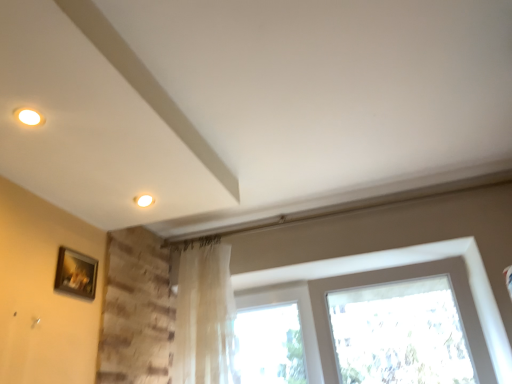
Find the location of a particular element. Image resolution: width=512 pixels, height=384 pixels. wooden picture frame at lower left is located at coordinates (76, 273).

Is translucent fabric at center positioned with its back to wooden picture frame at lower left?

translucent fabric at center does not have its back to wooden picture frame at lower left.

Are translucent fabric at center and wooden picture frame at lower left far apart?

That's right, there is a large distance between translucent fabric at center and wooden picture frame at lower left.

Looking at this image, is translucent fabric at center taller than wooden picture frame at lower left?

Yes, translucent fabric at center is taller than wooden picture frame at lower left.

Considering the relative sizes of translucent fabric at center and wooden picture frame at lower left in the image provided, is translucent fabric at center bigger than wooden picture frame at lower left?

Indeed, translucent fabric at center has a larger size compared to wooden picture frame at lower left.

From the image's perspective, is wooden picture frame at lower left below translucent fabric curtain at center?

No, from the image's perspective, wooden picture frame at lower left is not beneath translucent fabric curtain at center.

From a real-world perspective, who is located higher, wooden picture frame at lower left or translucent fabric curtain at center?

In real-world perspective, wooden picture frame at lower left is above.

Can you confirm if wooden picture frame at lower left is wider than translucent fabric curtain at center?

In fact, wooden picture frame at lower left might be narrower than translucent fabric curtain at center.

This screenshot has height=384, width=512. In order to click on curtain behind the wooden picture frame at lower left in this screenshot , I will do `click(204, 316)`.

Which point is more forward, (342, 277) or (185, 298)?

The point (342, 277) is closer to the camera.

Measure the distance between translucent fabric at center and translucent fabric curtain at center.

translucent fabric at center and translucent fabric curtain at center are 15.88 inches apart from each other.

Based on the photo, between translucent fabric at center and translucent fabric curtain at center, which one has less height?

translucent fabric at center.

Is translucent fabric curtain at center at the back of translucent fabric at center?

No, translucent fabric curtain at center is not at the back of translucent fabric at center.

Can you confirm if wooden picture frame at lower left is taller than translucent fabric at center?

Incorrect, the height of wooden picture frame at lower left is not larger of that of translucent fabric at center.

Is the position of wooden picture frame at lower left more distant than that of translucent fabric at center?

Yes, it is behind translucent fabric at center.

In the scene shown: How different are the orientations of wooden picture frame at lower left and translucent fabric at center in degrees?

They differ by 89.7 degrees in their facing directions.

From the image's perspective, is wooden picture frame at lower left on top of translucent fabric at center?

Yes, from the image's perspective, wooden picture frame at lower left is over translucent fabric at center.

Are translucent fabric curtain at center and wooden picture frame at lower left far apart?

That's not correct — translucent fabric curtain at center is a little close to wooden picture frame at lower left.

Considering the sizes of translucent fabric curtain at center and wooden picture frame at lower left in the image, is translucent fabric curtain at center bigger or smaller than wooden picture frame at lower left?

translucent fabric curtain at center is bigger than wooden picture frame at lower left.

Which point is more forward, (x=224, y=344) or (x=83, y=280)?

Point (x=83, y=280)

Considering the sizes of translucent fabric curtain at center and wooden picture frame at lower left in the image, is translucent fabric curtain at center taller or shorter than wooden picture frame at lower left?

Considering their sizes, translucent fabric curtain at center has more height than wooden picture frame at lower left.

Is translucent fabric curtain at center closer to the viewer compared to translucent fabric at center?

That is False.

How much distance is there between translucent fabric curtain at center and translucent fabric at center?

translucent fabric curtain at center and translucent fabric at center are 15.88 inches apart from each other.

What's the angular difference between translucent fabric curtain at center and translucent fabric at center's facing directions?

They differ by 0.754 degrees in their facing directions.

Is translucent fabric curtain at center positioned far away from translucent fabric at center?

No, translucent fabric curtain at center is in close proximity to translucent fabric at center.

Image resolution: width=512 pixels, height=384 pixels. In order to click on picture frame behind the translucent fabric at center in this screenshot , I will do `click(76, 273)`.

Locate an element on the screen. This screenshot has width=512, height=384. curtain located on the right of wooden picture frame at lower left is located at coordinates (204, 316).

When comparing their distances from wooden picture frame at lower left, does translucent fabric at center or translucent fabric curtain at center seem further?

translucent fabric at center.

Estimate the real-world distances between objects in this image. Which object is further from translucent fabric curtain at center, translucent fabric at center or wooden picture frame at lower left?

The object further to translucent fabric curtain at center is wooden picture frame at lower left.

From the image, which object appears to be farther from wooden picture frame at lower left, translucent fabric curtain at center or translucent fabric at center?

translucent fabric at center is further to wooden picture frame at lower left.

Looking at the image, which one is located closer to translucent fabric at center, wooden picture frame at lower left or translucent fabric curtain at center?

translucent fabric curtain at center is closer to translucent fabric at center.

When comparing their distances from translucent fabric at center, does translucent fabric curtain at center or wooden picture frame at lower left seem further?

wooden picture frame at lower left.

Looking at the image, which one is located further to translucent fabric curtain at center, wooden picture frame at lower left or translucent fabric at center?

wooden picture frame at lower left lies further to translucent fabric curtain at center than the other object.

Locate an element on the screen. curtain located between wooden picture frame at lower left and translucent fabric at center in the left-right direction is located at coordinates click(x=204, y=316).